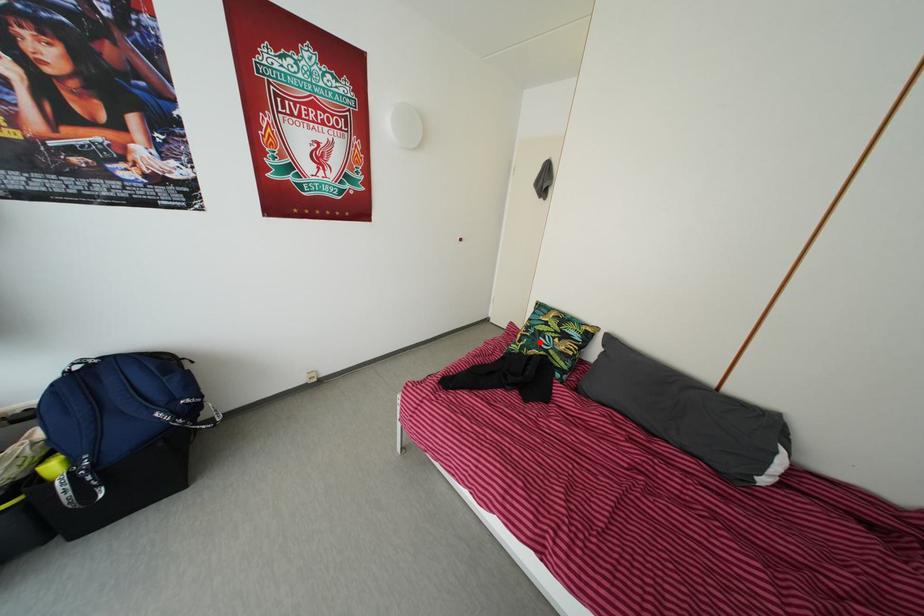
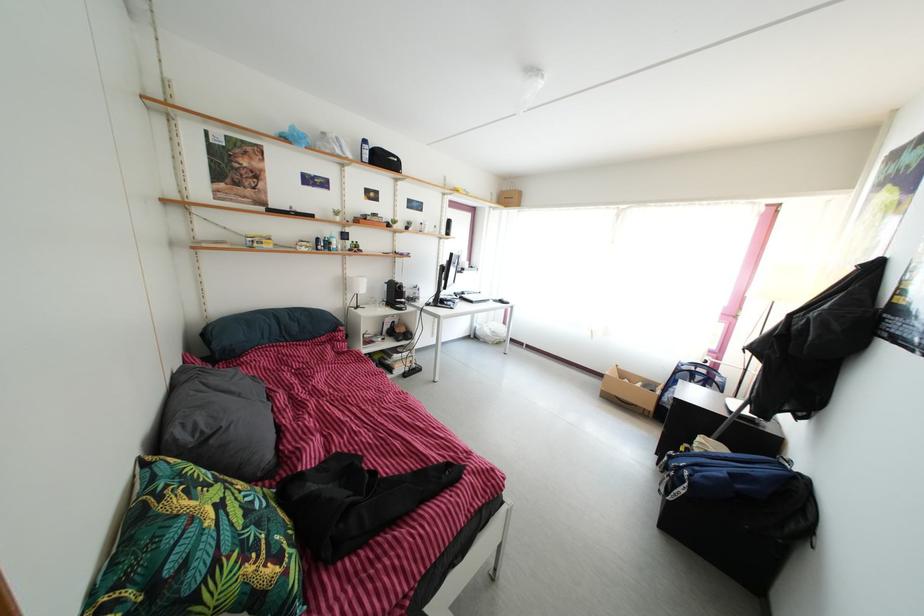
The point at the highlighted location is marked in the first image. Where is the corresponding point in the second image?

(264, 533)